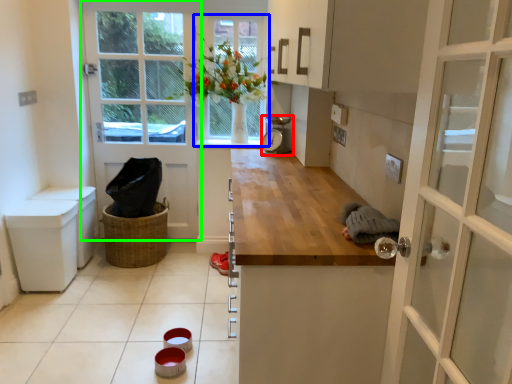
Question: Estimate the real-world distances between objects in this image. Which object is closer to appliance (highlighted by a red box), window (highlighted by a blue box) or door (highlighted by a green box)?

Choices:
 (A) window
 (B) door

Answer: (A)